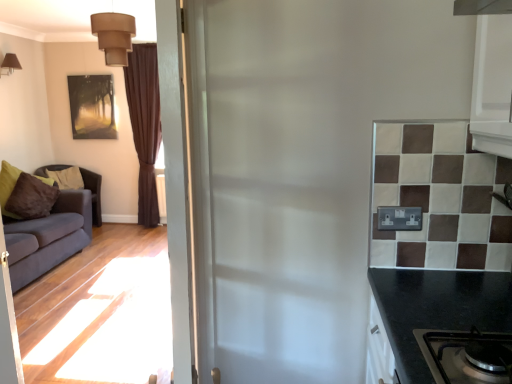
Question: Is matte brown wall light at upper left, the 1th lamp in the left-to-right sequence, positioned far away from brown velvet curtain at left?

Choices:
 (A) no
 (B) yes

Answer: (B)

Question: Does matte brown wall light at upper left, the 1th lamp from the back, have a lesser width compared to brown velvet curtain at left?

Choices:
 (A) no
 (B) yes

Answer: (A)

Question: From the image's perspective, does matte brown wall light at upper left, positioned as the second lamp in front-to-back order, appear lower than brown velvet curtain at left?

Choices:
 (A) yes
 (B) no

Answer: (B)

Question: Could brown velvet curtain at left be considered to be inside matte brown wall light at upper left, positioned as the second lamp in front-to-back order?

Choices:
 (A) yes
 (B) no

Answer: (B)

Question: Is matte brown wall light at upper left, marked as the second lamp in a right-to-left arrangement, further to camera compared to brown velvet curtain at left?

Choices:
 (A) yes
 (B) no

Answer: (B)

Question: In terms of height, does brown velvet curtain at left look taller or shorter compared to matte gold picture frame at upper left?

Choices:
 (A) tall
 (B) short

Answer: (A)

Question: Is brown velvet curtain at left situated inside matte gold picture frame at upper left or outside?

Choices:
 (A) outside
 (B) inside

Answer: (A)

Question: In terms of width, does brown velvet curtain at left look wider or thinner when compared to matte gold picture frame at upper left?

Choices:
 (A) thin
 (B) wide

Answer: (B)

Question: Looking at the image, does brown velvet curtain at left seem bigger or smaller compared to matte gold picture frame at upper left?

Choices:
 (A) small
 (B) big

Answer: (B)

Question: Based on their positions, is matte brown wall light at upper left, the 1th lamp in the left-to-right sequence, located to the left or right of white glossy door at center?

Choices:
 (A) left
 (B) right

Answer: (A)

Question: Would you say matte brown wall light at upper left, positioned as the second lamp in front-to-back order, is inside or outside white glossy door at center?

Choices:
 (A) inside
 (B) outside

Answer: (B)

Question: Relative to white glossy door at center, is matte brown wall light at upper left, the 1th lamp from the back, in front or behind?

Choices:
 (A) front
 (B) behind

Answer: (B)

Question: From the image's perspective, relative to white glossy door at center, is matte brown wall light at upper left, the 1th lamp from the back, above or below?

Choices:
 (A) below
 (B) above

Answer: (B)

Question: In terms of width, does matte brown wall light at upper left, the 1th lamp from the back, look wider or thinner when compared to matte gold picture frame at upper left?

Choices:
 (A) thin
 (B) wide

Answer: (B)

Question: Visually, is matte brown wall light at upper left, the 1th lamp in the left-to-right sequence, positioned to the left or to the right of matte gold picture frame at upper left?

Choices:
 (A) left
 (B) right

Answer: (A)